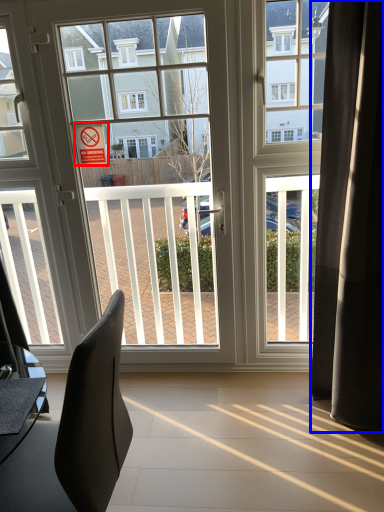
Question: Which point is further to the camera, parking sign (highlighted by a red box) or curtain (highlighted by a blue box)?

Choices:
 (A) parking sign
 (B) curtain

Answer: (A)